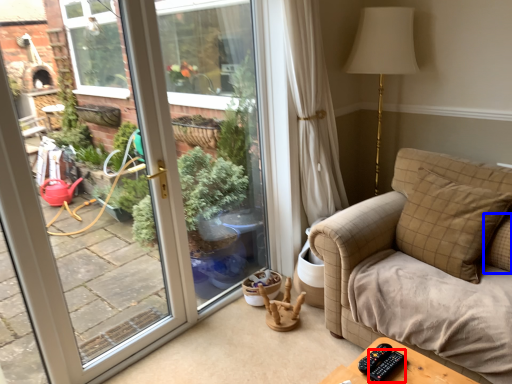
Question: Which object is further to the camera taking this photo, remote (highlighted by a red box) or pillow (highlighted by a blue box)?

Choices:
 (A) remote
 (B) pillow

Answer: (B)